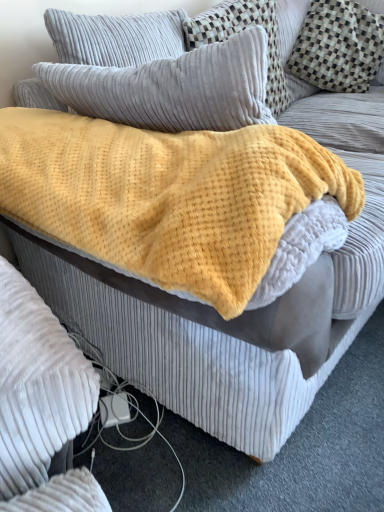
Question: From a real-world perspective, is yellow fuzzy blanket at center positioned under checkered fabric pillow at upper right, the first pillow from the right, based on gravity?

Choices:
 (A) no
 (B) yes

Answer: (A)

Question: Could checkered fabric pillow at upper right, the 3th pillow in the left-to-right sequence, be considered to be inside yellow fuzzy blanket at center?

Choices:
 (A) yes
 (B) no

Answer: (B)

Question: Is yellow fuzzy blanket at center at the right side of checkered fabric pillow at upper right, the first pillow from the right?

Choices:
 (A) yes
 (B) no

Answer: (B)

Question: Is yellow fuzzy blanket at center positioned with its back to checkered fabric pillow at upper right, the first pillow from the right?

Choices:
 (A) no
 (B) yes

Answer: (A)

Question: Does yellow fuzzy blanket at center lie behind checkered fabric pillow at upper right, the first pillow from the right?

Choices:
 (A) yes
 (B) no

Answer: (B)

Question: From the image's perspective, is velvet gray pillow at upper center, the 2th pillow when ordered from left to right, located above or below velvety gray pillow at upper left, which appears as the 1th pillow when viewed from the left?

Choices:
 (A) above
 (B) below

Answer: (A)

Question: Is point (193, 34) closer or farther from the camera than point (223, 46)?

Choices:
 (A) closer
 (B) farther

Answer: (B)

Question: Is velvet gray pillow at upper center, the 2th pillow from the right, situated inside velvety gray pillow at upper left, which appears as the 1th pillow when viewed from the left, or outside?

Choices:
 (A) inside
 (B) outside

Answer: (B)

Question: Looking at the image, does velvet gray pillow at upper center, the 2th pillow when ordered from left to right, seem bigger or smaller compared to velvety gray pillow at upper left, the 3th pillow viewed from the right?

Choices:
 (A) big
 (B) small

Answer: (A)

Question: In terms of size, does velvet gray pillow at upper center, the 2th pillow when ordered from left to right, appear bigger or smaller than yellow fuzzy blanket at center?

Choices:
 (A) small
 (B) big

Answer: (A)

Question: From a real-world perspective, is velvet gray pillow at upper center, the 2th pillow from the right, physically located above or below yellow fuzzy blanket at center?

Choices:
 (A) above
 (B) below

Answer: (B)

Question: In the image, is velvet gray pillow at upper center, the 2th pillow when ordered from left to right, on the left side or the right side of yellow fuzzy blanket at center?

Choices:
 (A) left
 (B) right

Answer: (B)

Question: Is velvet gray pillow at upper center, the 2th pillow when ordered from left to right, situated inside yellow fuzzy blanket at center or outside?

Choices:
 (A) outside
 (B) inside

Answer: (A)

Question: From a real-world perspective, relative to checkered fabric pillow at upper right, the first pillow from the right, is velvety gray pillow at upper left, which appears as the 1th pillow when viewed from the left, vertically above or below?

Choices:
 (A) below
 (B) above

Answer: (B)

Question: In terms of height, does velvety gray pillow at upper left, which appears as the 1th pillow when viewed from the left, look taller or shorter compared to checkered fabric pillow at upper right, the first pillow from the right?

Choices:
 (A) short
 (B) tall

Answer: (A)